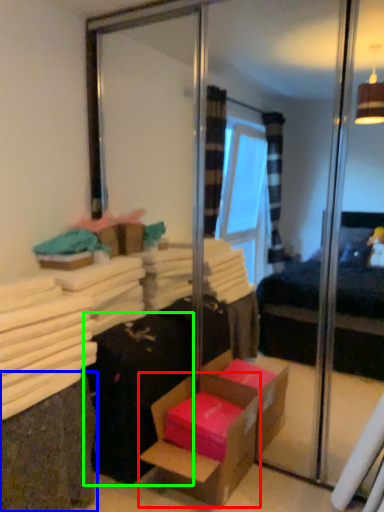
Question: Based on their relative distances, which object is nearer to box (highlighted by a red box)? Choose from shelf (highlighted by a blue box) and luggage (highlighted by a green box).

Choices:
 (A) shelf
 (B) luggage

Answer: (B)